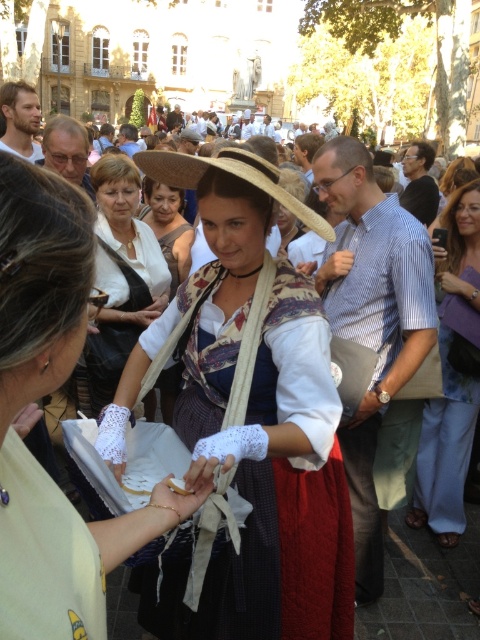
You are a photographer at the event and want to capture both the matte white lace gloves at center and the blue denim pants at lower right in the same frame. Based on their positions, which object should you adjust your camera to focus on first to ensure both are in the shot?

The matte white lace gloves at center is positioned on the left side of blue denim pants at lower right, so you should focus on the blue denim pants at lower right first to ensure both objects are included in the frame.

You are standing at the center of the town square and see two points marked in the image. The first point is at coordinate point (255,468) and the second is at point (451,266). Which point is closer to you?

Point (255,468) is in front of point (451,266), so the first point is closer to you.